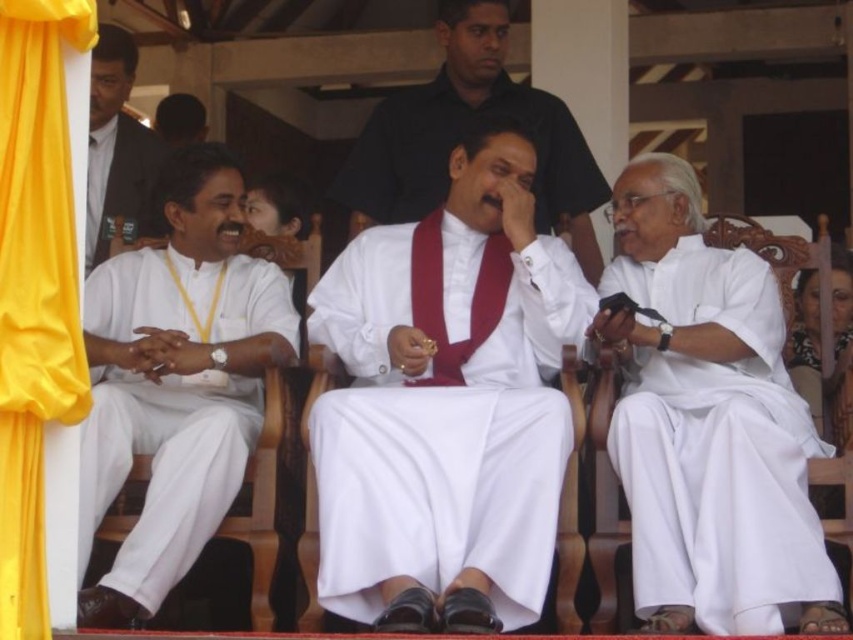
You are a photographer trying to capture the man in the white silk robe at center. Given that your camera can only focus on objects within a 0.5 unit radius from the center point, will the robe be in focus?

The white silk robe at center is located at point (440,433). Since the camera focuses within 0.5 units from the center, the distance from the center to the robe is sqrt. The distance from the center to the robe is sqrt. The distance from the center to the robe is sqrt. The distance from the center to the robe is sqrt. The distance from the center to the robe is sqrt. The distance from the center to the robe is sqrt. The distance from the center to the robe is sqrt. The distance from the center to therobe

You are attending a formal event and need to locate the central figure wearing the white silk robe at center. Based on the coordinates provided, which direction should you face to ensure you are looking directly at the robe?

The white silk robe at center is located at coordinates point [440,433], so you should face the center of the stage to ensure you are looking directly at the robe.

You are a stagehand who needs to move a 10 meter long ladder from the yellow fabric curtain at left to the white silk robe at center. Can you move the ladder without folding it?

The white silk robe at center is 12.65 meters away from the yellow fabric curtain at left. Since the ladder is 10 meters long, you can move it without folding as the distance between them is greater than the ladder length.